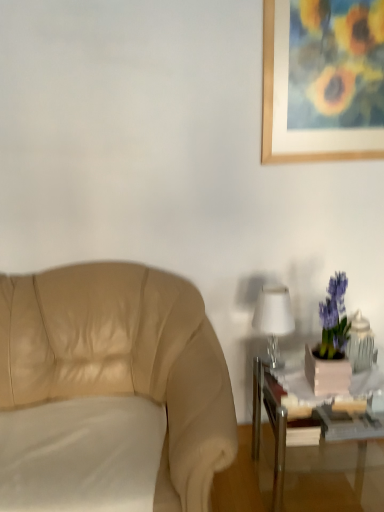
Question: From the image's perspective, is metallic silver table at lower right above or below beige leather chair at left?

Choices:
 (A) below
 (B) above

Answer: (A)

Question: Is metallic silver table at lower right in front of or behind beige leather chair at left in the image?

Choices:
 (A) behind
 (B) front

Answer: (A)

Question: Which object is positioned farthest from the metallic silver table at lower right?

Choices:
 (A) white glossy table lamp at right
 (B) wooden picture frame at upper right
 (C) white fabric pillow at lower left
 (D) beige leather chair at left

Answer: (B)

Question: Which of these objects is positioned closest to the beige leather chair at left?

Choices:
 (A) white fabric pillow at lower left
 (B) metallic silver table at lower right
 (C) wooden picture frame at upper right
 (D) white glossy table lamp at right

Answer: (A)